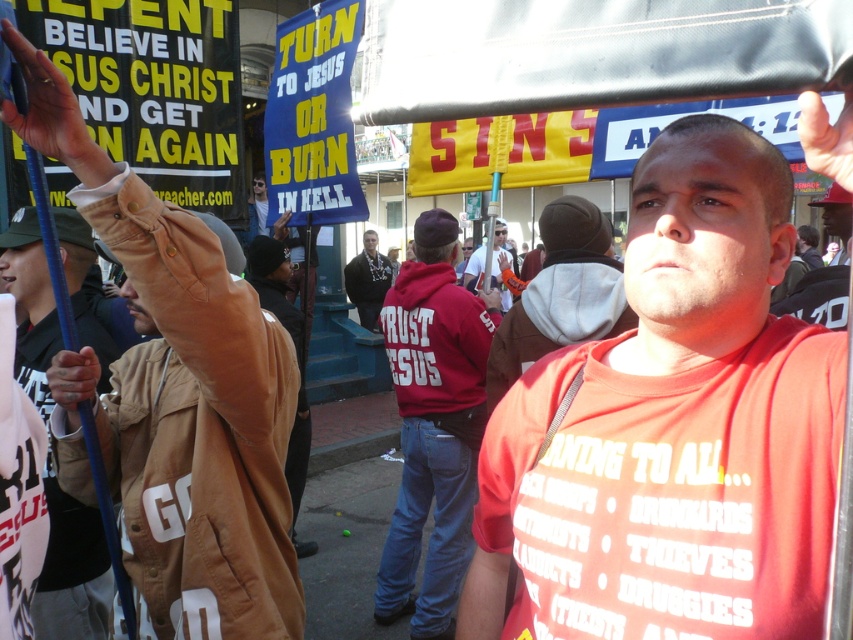
In the scene shown: You are a photographer standing in the middle of the street. You notice the matte white shirt at center and the matte black sunglasses at upper left. Which object is positioned lower from your viewpoint?

The matte white shirt at center is below the matte black sunglasses at upper left, so the matte white shirt at center is positioned lower from your viewpoint.

You are a photographer trying to capture a closeup of the brown leather jacket at upper left and the matte black sunglasses at upper left. Since both are at the upper left, which one will appear larger in your photo?

The brown leather jacket at upper left appears larger in the photo because it has a greater height compared to the matte black sunglasses at upper left.

You are a photographer trying to capture both the brown leather jacket at upper left and the brown suede jacket at center in the same frame. Which jacket should you position your camera closer to in order to include both?

You should position your camera closer to the brown suede jacket at center because the brown leather jacket at upper left is on its right side, so moving towards the center jacket allows both to be in frame.